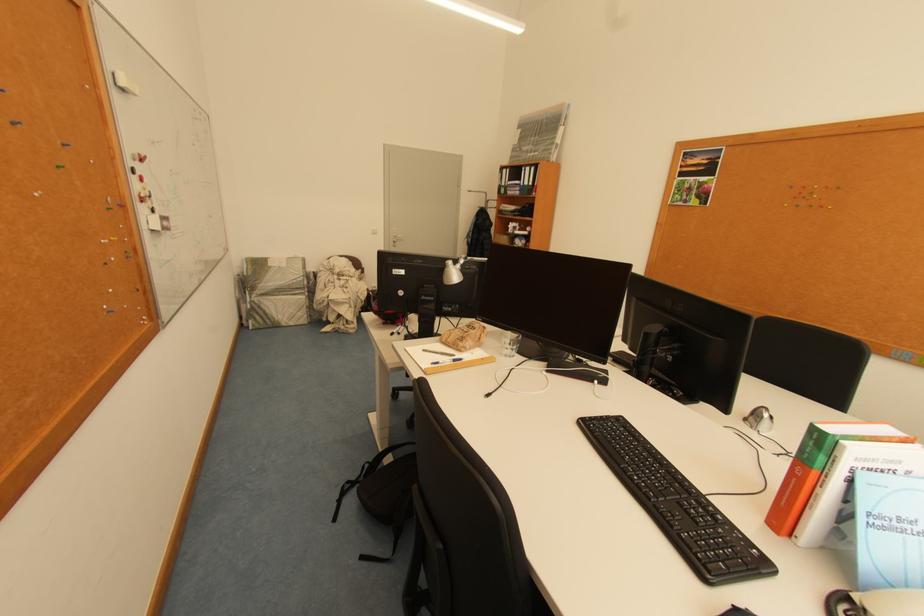
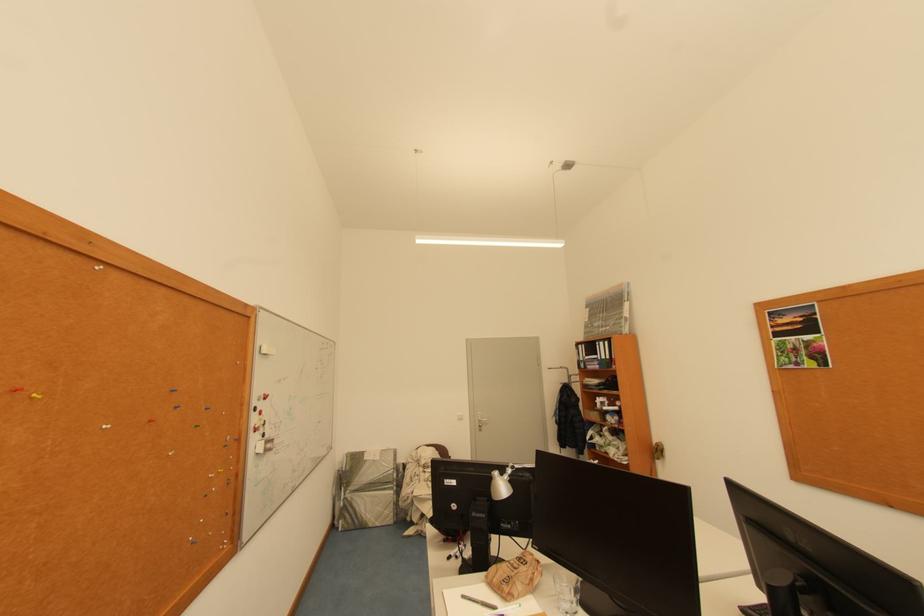
First-person continuous shooting, in which direction is the camera rotating?

The camera rotated toward left-up.